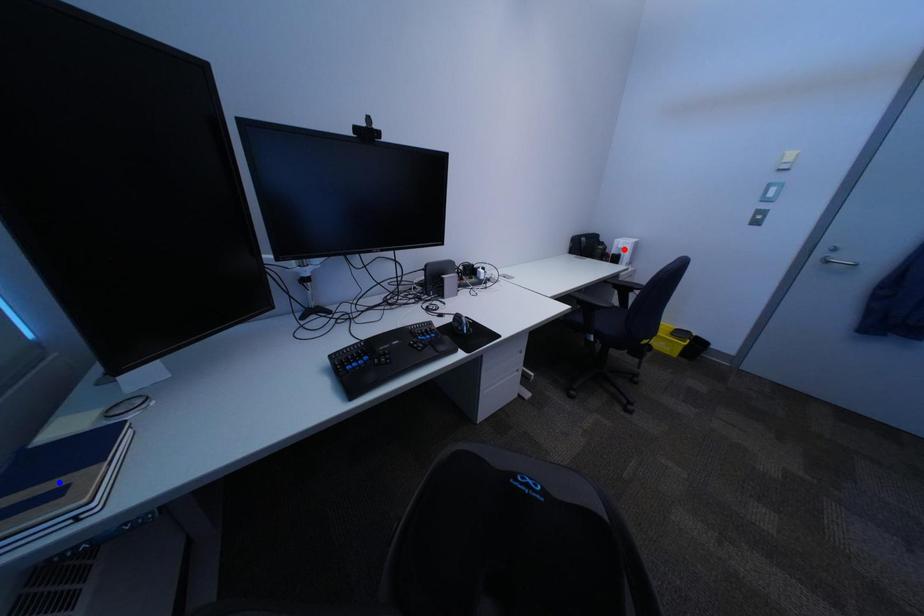
Question: Two points are marked on the image. Which point is closer to the camera?

Choices:
 (A) Blue point is closer.
 (B) Red point is closer.

Answer: (A)